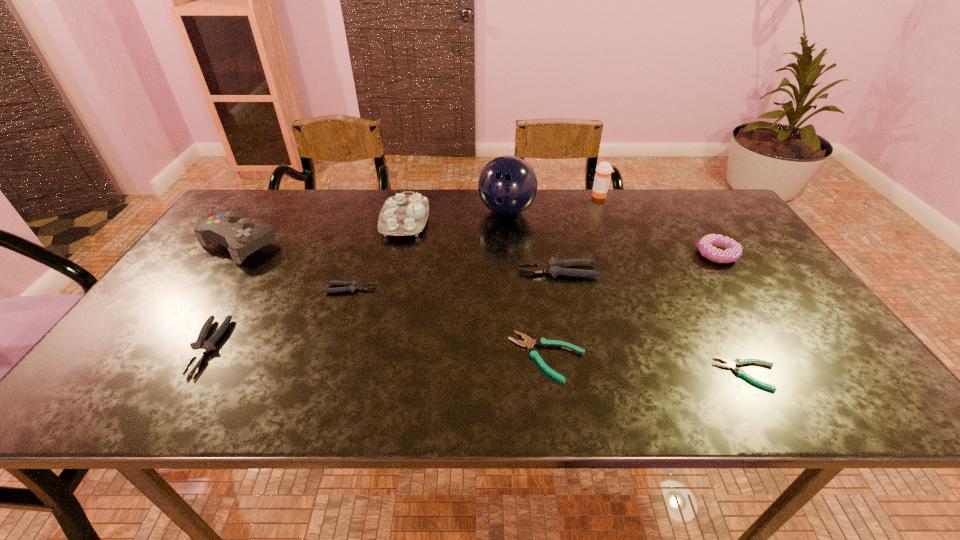
This screenshot has height=540, width=960. Identify the location of the leftmost pliers. (200, 347).

Locate an element on the screen. This screenshot has height=540, width=960. the fourth shortest object is located at coordinates [200, 347].

What are the coordinates of `the second nearest gray pliers` in the screenshot? It's located at (351, 285).

The image size is (960, 540). What are the coordinates of `the fourth nearest object` in the screenshot? It's located at (351, 285).

This screenshot has height=540, width=960. What are the coordinates of `the second shortest object` in the screenshot? It's located at (542, 342).

At what (x,y) coordinates should I click in order to perform the action: click on the left teal pliers. Please return your answer as a coordinate pair (x, y). Image resolution: width=960 pixels, height=540 pixels. Looking at the image, I should click on (542, 342).

I want to click on the shortest pliers, so click(737, 362).

The width and height of the screenshot is (960, 540). I want to click on the right teal pliers, so click(737, 362).

Where is `free space located on the surface of the bowling ball near the finger holes`? free space located on the surface of the bowling ball near the finger holes is located at coordinates (509, 244).

Where is `free space located 0.120m on the left of the medicine`? The height and width of the screenshot is (540, 960). free space located 0.120m on the left of the medicine is located at coordinates (556, 195).